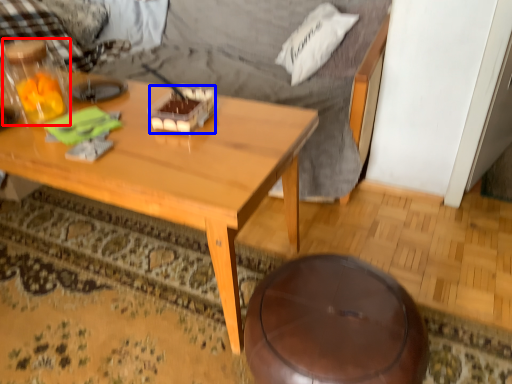
Question: Which of the following is the closest to the observer, bottle (highlighted by a red box) or food (highlighted by a blue box)?

Choices:
 (A) bottle
 (B) food

Answer: (A)